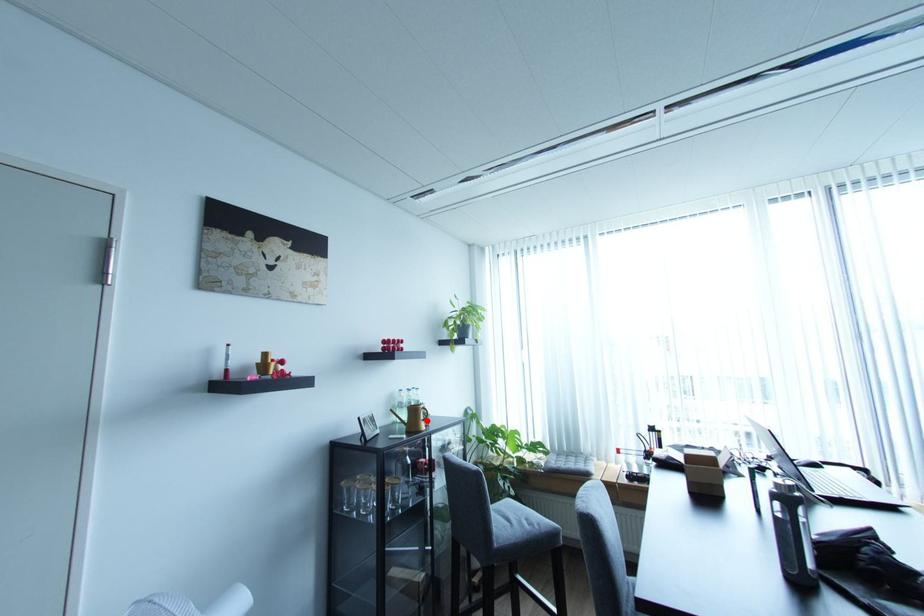
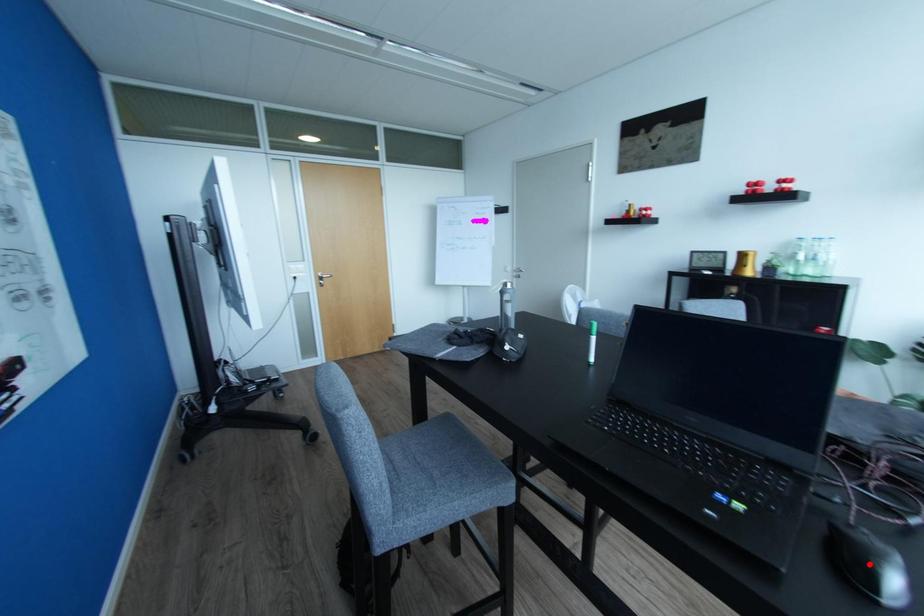
I am providing you with two images of the same scene from different viewpoints. A red point is marked on the first image and another point is marked on the second image. Is the red point in image1 aligned with the point shown in image2?

No